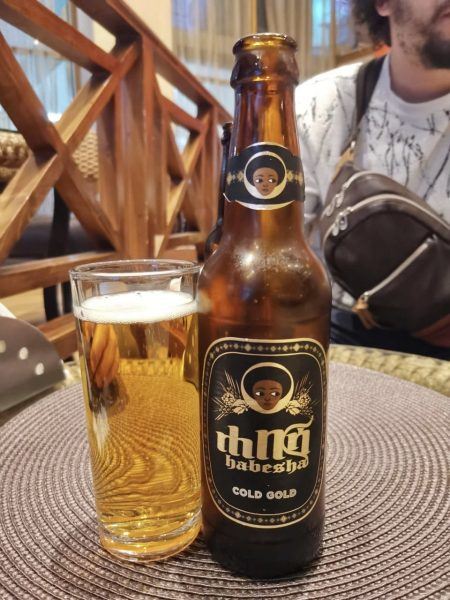
This screenshot has width=450, height=600. In order to click on placemat in this screenshot , I will do `click(393, 432)`, `click(53, 551)`.